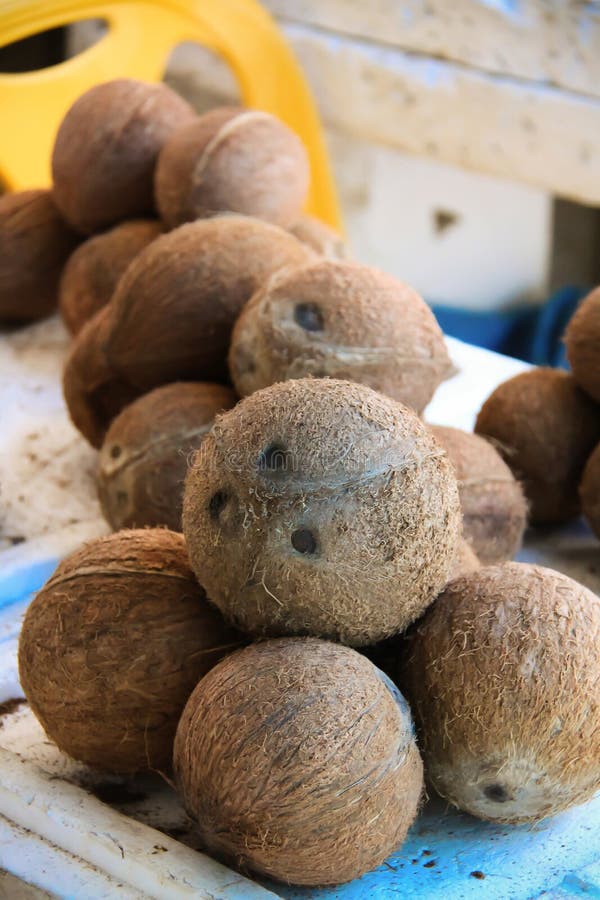
Identify the location of yellow plastic chair. This screenshot has width=600, height=900. (19, 14).